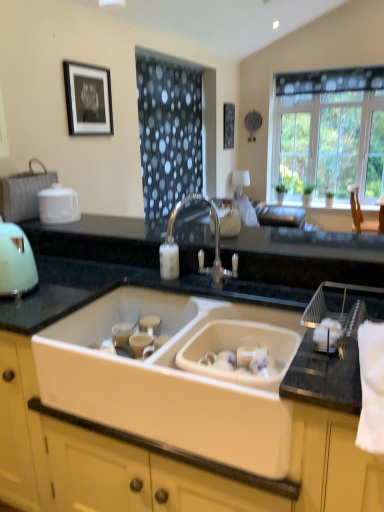
Image resolution: width=384 pixels, height=512 pixels. Identify the location of vacant point above clear glass window at upper right (from a real-world perspective). (328, 67).